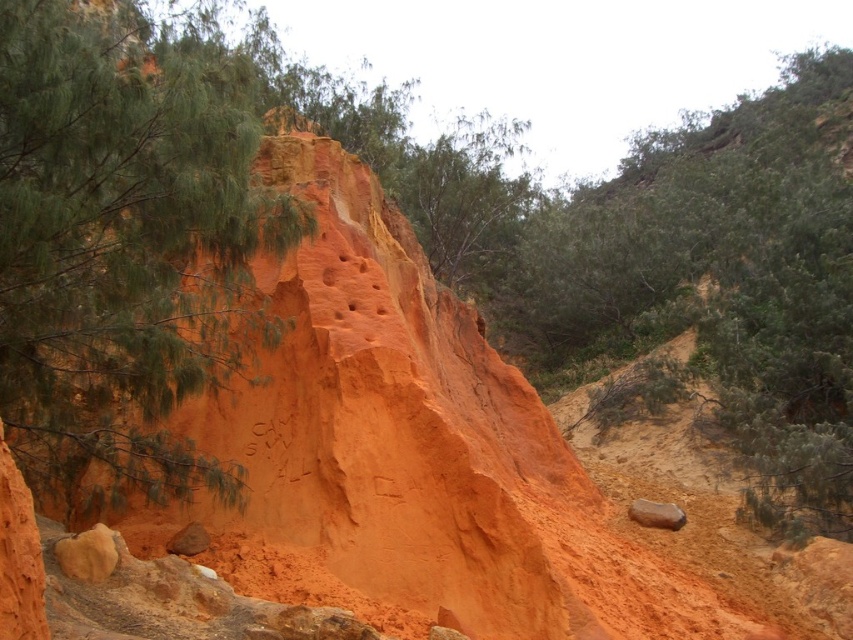
Question: Can you confirm if green leafy tree at upper center is bigger than smooth brown rock at lower right?

Choices:
 (A) yes
 (B) no

Answer: (A)

Question: Which point is closer to the camera?

Choices:
 (A) smooth brown rock at lower right
 (B) green leafy tree at upper center

Answer: (B)

Question: Can you confirm if green leafy tree at upper left is thinner than smooth brown rock at lower right?

Choices:
 (A) no
 (B) yes

Answer: (A)

Question: Estimate the real-world distances between objects in this image. Which object is farther from the green leafy tree at upper left?

Choices:
 (A) smooth brown rock at lower right
 (B) green leafy tree at upper center

Answer: (B)

Question: Which object appears closest to the camera in this image?

Choices:
 (A) green leafy tree at upper left
 (B) smooth brown rock at lower right

Answer: (A)

Question: Is green leafy tree at upper left wider than smooth brown rock at lower right?

Choices:
 (A) no
 (B) yes

Answer: (B)